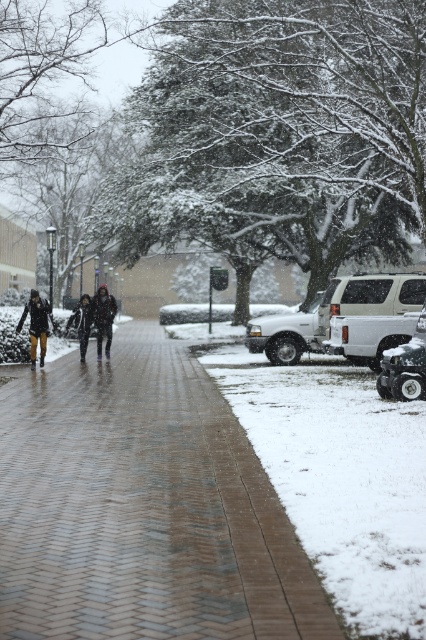
Is white powdery snow at lower right to the left of dark gray wool coat at center from the viewer's perspective?

In fact, white powdery snow at lower right is to the right of dark gray wool coat at center.

Can you confirm if white powdery snow at lower right is wider than dark gray wool coat at center?

Yes, white powdery snow at lower right is wider than dark gray wool coat at center.

The width and height of the screenshot is (426, 640). What do you see at coordinates (340, 480) in the screenshot?
I see `white powdery snow at lower right` at bounding box center [340, 480].

The image size is (426, 640). What are the coordinates of `white powdery snow at lower right` in the screenshot? It's located at (340, 480).

Who is positioned more to the left, white powdery snow at lower right or yellow pants at center?

yellow pants at center is more to the left.

Is point (365, 532) farther from camera compared to point (39, 296)?

No, it is in front of (39, 296).

Where is `white powdery snow at lower right`? white powdery snow at lower right is located at coordinates (340, 480).

Does dark gray wool coat at center appear over dark gray fabric jacket at center?

No, dark gray wool coat at center is not above dark gray fabric jacket at center.

Based on the photo, does dark gray wool coat at center have a larger size compared to dark gray fabric jacket at center?

Actually, dark gray wool coat at center might be smaller than dark gray fabric jacket at center.

This screenshot has height=640, width=426. Describe the element at coordinates (94, 320) in the screenshot. I see `dark gray wool coat at center` at that location.

Where is `dark gray wool coat at center`? dark gray wool coat at center is located at coordinates (94, 320).